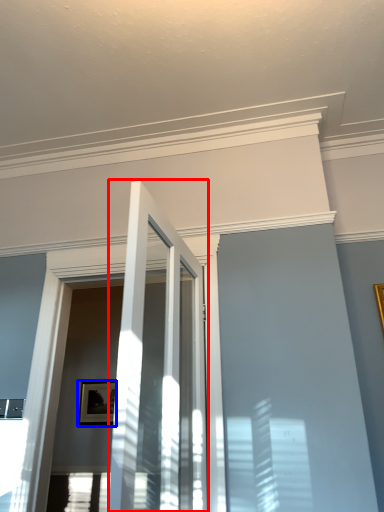
Question: Which object is closer to the camera taking this photo, door (highlighted by a red box) or picture frame (highlighted by a blue box)?

Choices:
 (A) door
 (B) picture frame

Answer: (A)